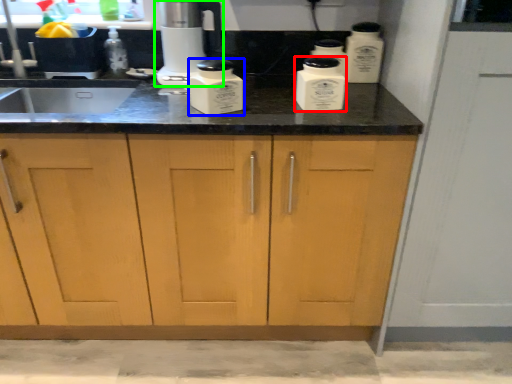
Question: Estimate the real-world distances between objects in this image. Which object is closer to kitchen appliance (highlighted by a red box), kitchen appliance (highlighted by a blue box) or home appliance (highlighted by a green box)?

Choices:
 (A) kitchen appliance
 (B) home appliance

Answer: (A)